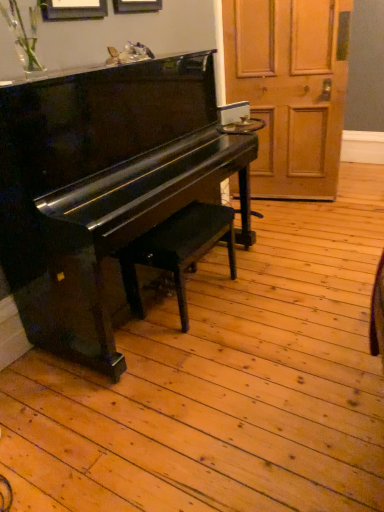
Question: From the image's perspective, is wooden door at right below matte black bench at center?

Choices:
 (A) yes
 (B) no

Answer: (B)

Question: Are wooden door at right and matte black bench at center far apart?

Choices:
 (A) yes
 (B) no

Answer: (A)

Question: From a real-world perspective, is wooden door at right on matte black bench at center?

Choices:
 (A) no
 (B) yes

Answer: (B)

Question: From a real-world perspective, is wooden door at right below matte black bench at center?

Choices:
 (A) yes
 (B) no

Answer: (B)

Question: Is the depth of wooden door at right less than that of matte black bench at center?

Choices:
 (A) no
 (B) yes

Answer: (A)

Question: Would you say wooden door at right is outside matte black bench at center?

Choices:
 (A) no
 (B) yes

Answer: (B)

Question: Considering the relative positions of wooden door at right and glossy black piano at left in the image provided, is wooden door at right to the right of glossy black piano at left from the viewer's perspective?

Choices:
 (A) no
 (B) yes

Answer: (B)

Question: From a real-world perspective, is wooden door at right over glossy black piano at left?

Choices:
 (A) no
 (B) yes

Answer: (B)

Question: Can you confirm if wooden door at right is taller than glossy black piano at left?

Choices:
 (A) yes
 (B) no

Answer: (A)

Question: Is wooden door at right oriented away from glossy black piano at left?

Choices:
 (A) yes
 (B) no

Answer: (A)

Question: From a real-world perspective, is wooden door at right under glossy black piano at left?

Choices:
 (A) yes
 (B) no

Answer: (B)

Question: Could you tell me if wooden door at right is turned towards glossy black piano at left?

Choices:
 (A) yes
 (B) no

Answer: (B)

Question: Considering the relative sizes of glossy black piano at left and wooden door at right in the image provided, is glossy black piano at left shorter than wooden door at right?

Choices:
 (A) no
 (B) yes

Answer: (B)